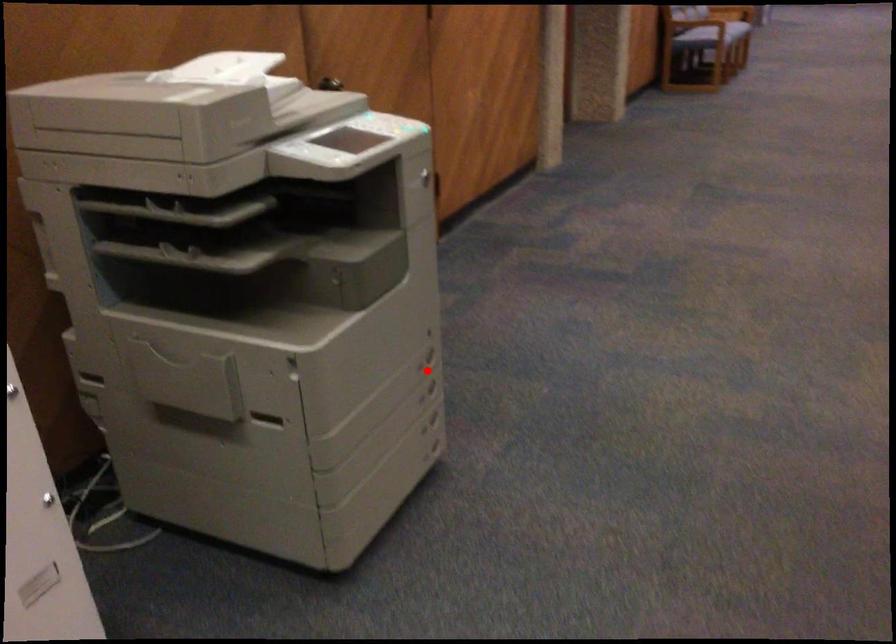
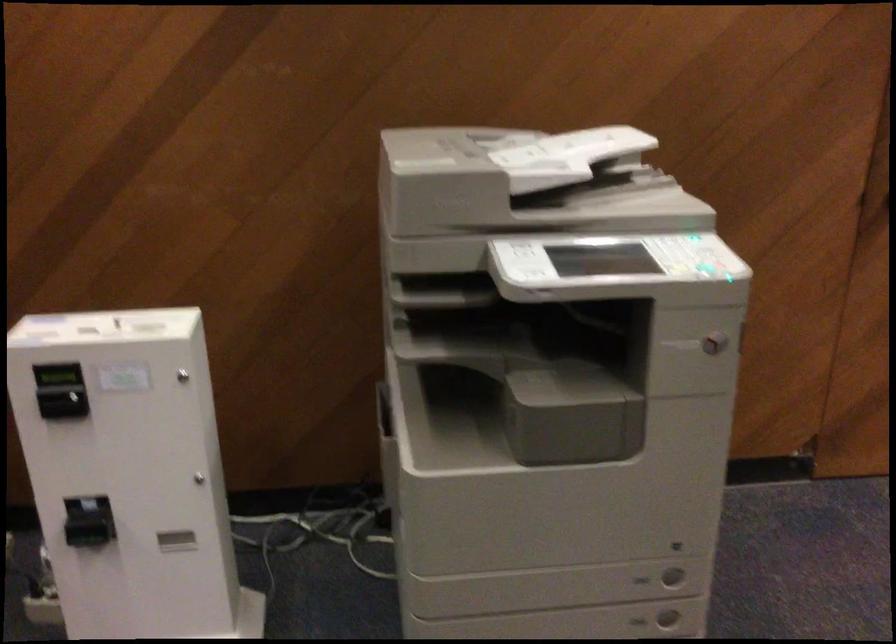
The point at the highlighted location is marked in the first image. Where is the corresponding point in the second image?

(642, 580)